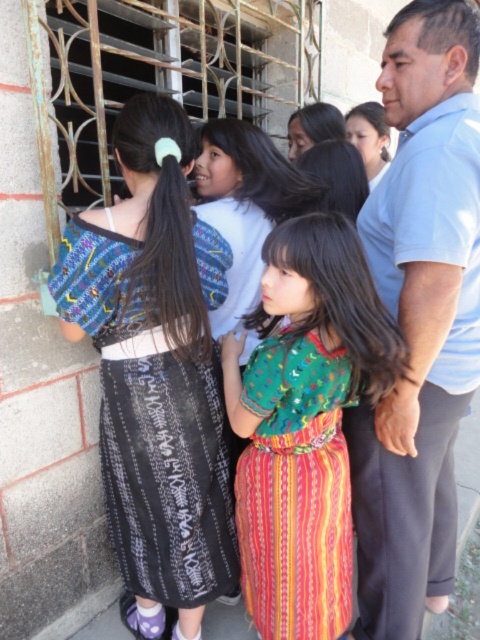
Is light blue shirt at center to the left of multicolored woven dress at center from the viewer's perspective?

No, light blue shirt at center is not to the left of multicolored woven dress at center.

Which is more to the left, light blue shirt at center or multicolored woven dress at center?

From the viewer's perspective, multicolored woven dress at center appears more on the left side.

What are the coordinates of `light blue shirt at center` in the screenshot? It's located at (420, 317).

Locate an element on the screen. light blue shirt at center is located at coordinates (420, 317).

Can you confirm if black woven skirt at left is smaller than multicolored woven dress at center?

No.

Between black woven skirt at left and multicolored woven dress at center, which one appears on the right side from the viewer's perspective?

multicolored woven dress at center

Identify the location of black woven skirt at left. The height and width of the screenshot is (640, 480). (152, 433).

Measure the distance between green woven dress at center and multicolored woven dress at center.

green woven dress at center and multicolored woven dress at center are 2.90 centimeters apart.

Is point (324, 300) positioned before point (315, 548)?

That is True.

The image size is (480, 640). Identify the location of green woven dress at center. (304, 422).